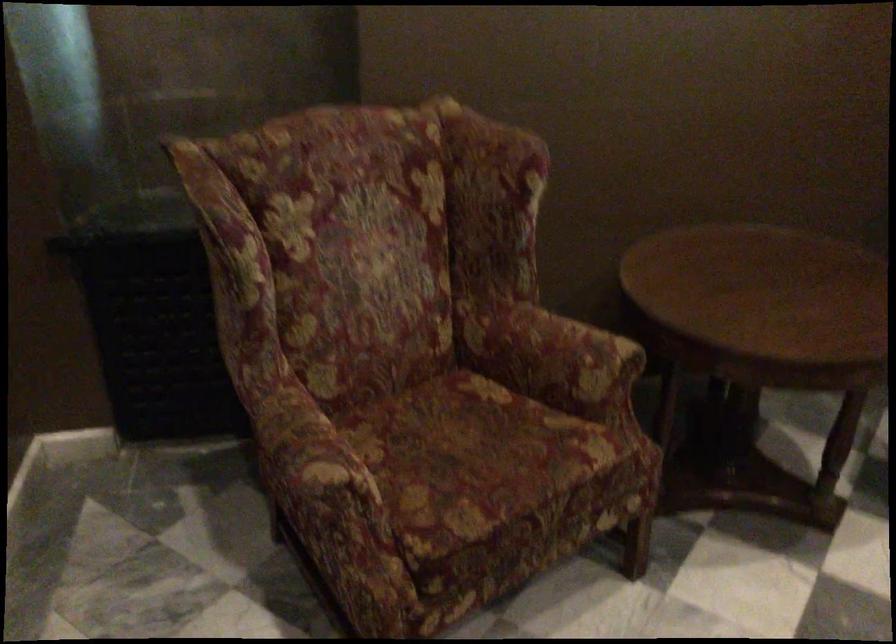
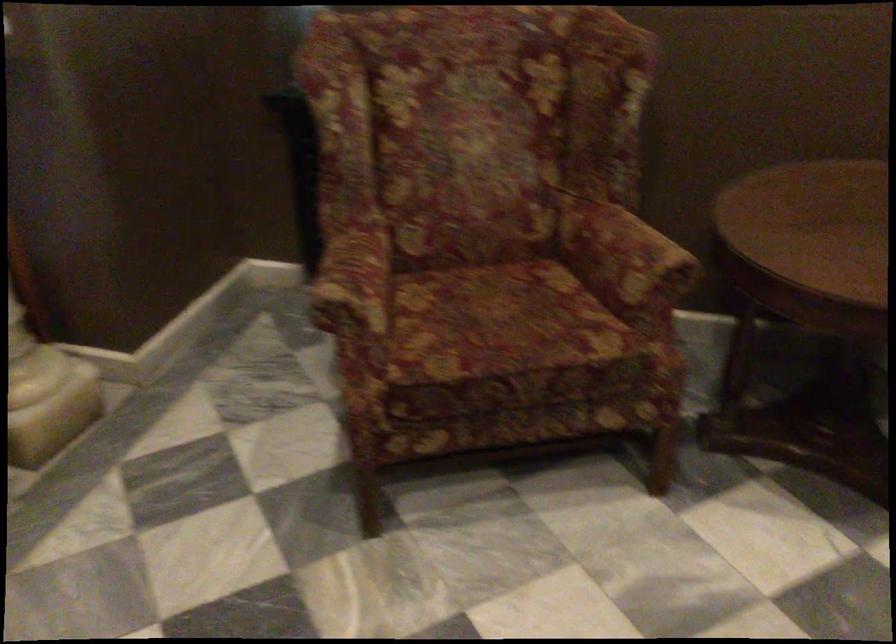
Where in the second image is the point corresponding to the point at 343,460 from the first image?

(355, 286)